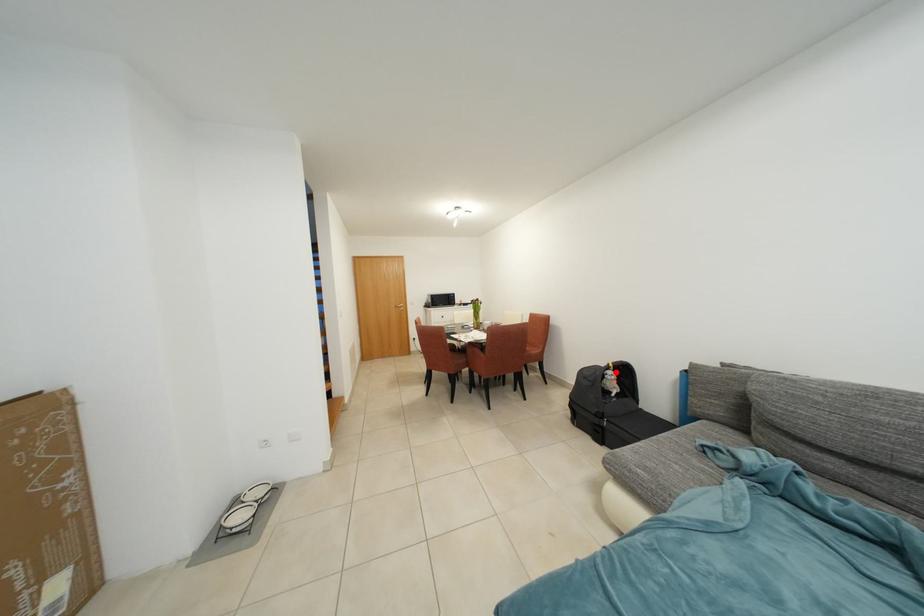
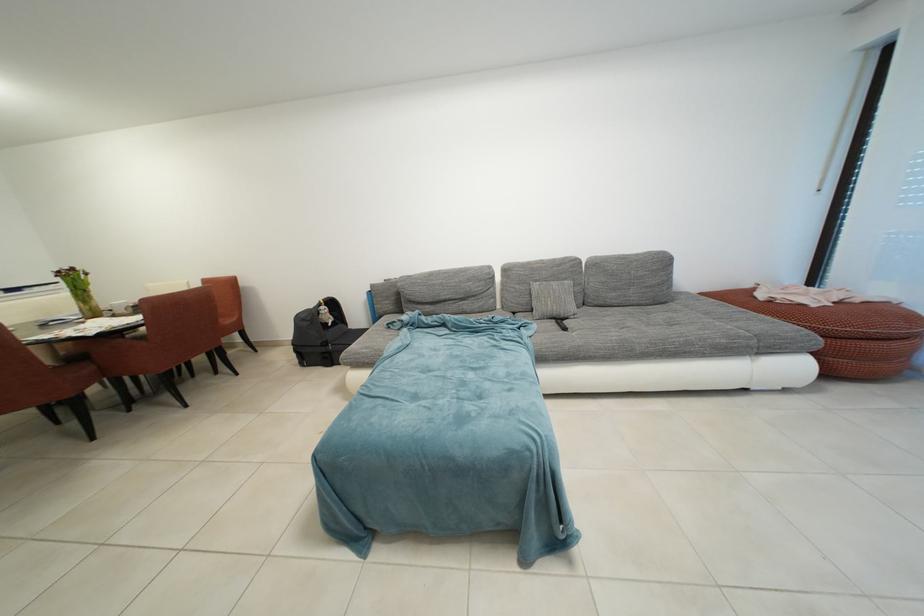
Question: I am providing you with two images of the same scene from different viewpoints. Given a red point in image1, look at the same physical point in image2. Is it:

Choices:
 (A) Closer to the viewpoint
 (B) Farther from the viewpoint

Answer: (A)